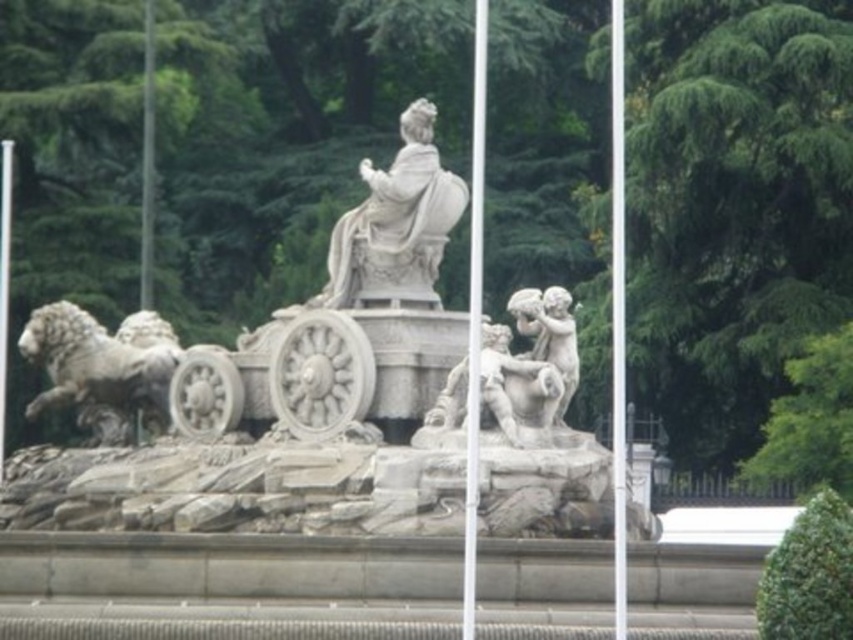
You are a city planner assessing the space around the white stone fountain at center and the white metal flag pole at center. Based on their sizes, which one would require more horizontal space for maintenance access?

The white stone fountain at center might require more horizontal space for maintenance access since it is wider than the white metal flag pole at center.